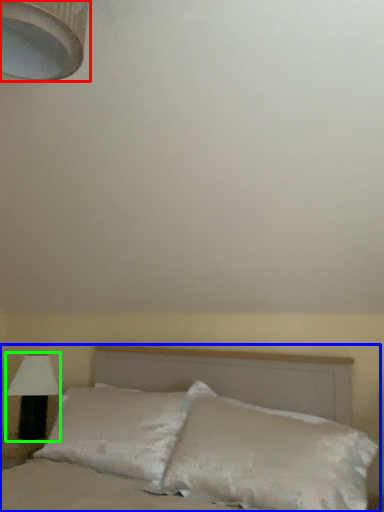
Question: Which is nearer to the lamp (highlighted by a red box)? bed (highlighted by a blue box) or lamp (highlighted by a green box).

Choices:
 (A) bed
 (B) lamp

Answer: (A)